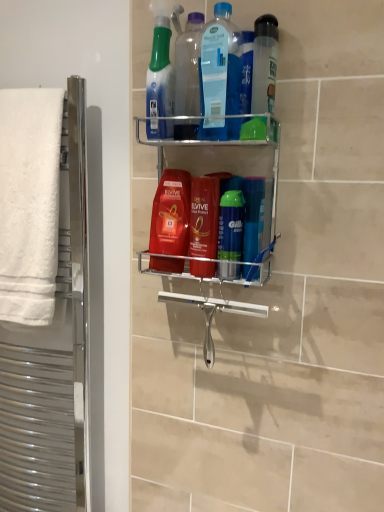
Image resolution: width=384 pixels, height=512 pixels. I want to click on transparent plastic bottle at upper center, so click(188, 66).

Find the location of a particular element. Image resolution: width=384 pixels, height=512 pixels. translucent plastic spray bottle at upper center, the first cleaning product from the top is located at coordinates (160, 76).

Which object is further away from the camera, transparent plastic bottle at upper center or blue plastic mouthwash at center, placed as the second mouthwash when sorted from right to left?

Positioned behind is blue plastic mouthwash at center, placed as the second mouthwash when sorted from right to left.

Where is `bottle on the left side of blue plastic mouthwash at center, which is counted as the third mouthwash, starting from the left`? bottle on the left side of blue plastic mouthwash at center, which is counted as the third mouthwash, starting from the left is located at coordinates (188, 66).

Is transparent plastic bottle at upper center oriented away from blue plastic mouthwash at center, placed as the second mouthwash when sorted from right to left?

No.

Does point (158, 76) appear closer or farther from the camera than point (257, 271)?

Point (158, 76).

Considering the sizes of translucent plastic spray bottle at upper center, the first cleaning product from the top, and blue plastic mouthwash at center, placed as the second mouthwash when sorted from right to left, in the image, is translucent plastic spray bottle at upper center, the first cleaning product from the top, taller or shorter than blue plastic mouthwash at center, placed as the second mouthwash when sorted from right to left,?

Clearly, translucent plastic spray bottle at upper center, the first cleaning product from the top, is taller compared to blue plastic mouthwash at center, placed as the second mouthwash when sorted from right to left.

There is a translucent plastic spray bottle at upper center, the first cleaning product from the top. Where is `the 3rd mouthwash below it (from a real-world perspective)`? The width and height of the screenshot is (384, 512). the 3rd mouthwash below it (from a real-world perspective) is located at coordinates (253, 218).

Is green matte mouthwash at center, arranged as the 3th mouthwash when viewed from the right, positioned behind transparent plastic bottle at upper center?

Yes, the depth of green matte mouthwash at center, arranged as the 3th mouthwash when viewed from the right, is greater than that of transparent plastic bottle at upper center.

Would you consider green matte mouthwash at center, placed as the 2th mouthwash when sorted from left to right, to be distant from transparent plastic bottle at upper center?

green matte mouthwash at center, placed as the 2th mouthwash when sorted from left to right, is near transparent plastic bottle at upper center, not far away.

Can you tell me how much green matte mouthwash at center, placed as the 2th mouthwash when sorted from left to right, and transparent plastic bottle at upper center differ in facing direction?

The facing directions of green matte mouthwash at center, placed as the 2th mouthwash when sorted from left to right, and transparent plastic bottle at upper center are 0.00641 degrees apart.

From the image's perspective, is green matte mouthwash at center, placed as the 2th mouthwash when sorted from left to right, located beneath transparent plastic bottle at upper center?

Correct, green matte mouthwash at center, placed as the 2th mouthwash when sorted from left to right, appears lower than transparent plastic bottle at upper center in the image.

Is red glossy mouthwash at center, the 4th mouthwash in the right-to-left sequence, to the right of white fluffy towel at left from the viewer's perspective?

Correct, you'll find red glossy mouthwash at center, the 4th mouthwash in the right-to-left sequence, to the right of white fluffy towel at left.

Is red glossy mouthwash at center, the 4th mouthwash in the right-to-left sequence, smaller than white fluffy towel at left?

Yes, red glossy mouthwash at center, the 4th mouthwash in the right-to-left sequence, is smaller than white fluffy towel at left.

Considering the relative sizes of red glossy mouthwash at center, the 4th mouthwash in the right-to-left sequence, and white fluffy towel at left in the image provided, is red glossy mouthwash at center, the 4th mouthwash in the right-to-left sequence, taller than white fluffy towel at left?

No.

Considering the sizes of shiny orange shampoo at center, placed as the 3th cleaning product when sorted from top to bottom, and metallic silver shelf at center in the image, is shiny orange shampoo at center, placed as the 3th cleaning product when sorted from top to bottom, bigger or smaller than metallic silver shelf at center?

shiny orange shampoo at center, placed as the 3th cleaning product when sorted from top to bottom, is smaller than metallic silver shelf at center.

Could you tell me if shiny orange shampoo at center, placed as the 3th cleaning product when sorted from top to bottom, is turned towards metallic silver shelf at center?

Yes.

Is point (168, 177) closer or farther from the camera than point (166, 160)?

Point (168, 177).

Is red glossy mouthwash at center, the 1th mouthwash viewed from the left, far from transparent plastic bottle at upper center?

No, there isn't a large distance between red glossy mouthwash at center, the 1th mouthwash viewed from the left, and transparent plastic bottle at upper center.

From a real-world perspective, does red glossy mouthwash at center, the 4th mouthwash in the right-to-left sequence, stand above transparent plastic bottle at upper center?

No, from a real-world perspective, red glossy mouthwash at center, the 4th mouthwash in the right-to-left sequence, is not on top of transparent plastic bottle at upper center.

Which object is thinner, red glossy mouthwash at center, the 1th mouthwash viewed from the left, or transparent plastic bottle at upper center?

With smaller width is transparent plastic bottle at upper center.

Who is smaller, white towel at left or red glossy mouthwash at center, the 4th mouthwash in the right-to-left sequence?

Smaller between the two is red glossy mouthwash at center, the 4th mouthwash in the right-to-left sequence.

Can you confirm if white towel at left is shorter than red glossy mouthwash at center, the 1th mouthwash viewed from the left?

No, white towel at left is not shorter than red glossy mouthwash at center, the 1th mouthwash viewed from the left.

Is white towel at left completely or partially outside of red glossy mouthwash at center, the 4th mouthwash in the right-to-left sequence?

Yes.

This screenshot has width=384, height=512. In order to click on bottle positioned vertically above the blue plastic mouthwash at center, placed as the second mouthwash when sorted from right to left (from a real-world perspective) in this screenshot , I will do `click(188, 66)`.

What are the coordinates of `the 3rd cleaning product above the blue plastic mouthwash at center, which is counted as the third mouthwash, starting from the left (from the image's perspective)` in the screenshot? It's located at (160, 76).

Based on their spatial positions, is metallic silver shelf at center or translucent plastic spray bottle at upper center, the 3th cleaning product in the bottom-to-top sequence, closer to clear plastic bottle at upper center, the fourth mouthwash from the left?

Based on the image, metallic silver shelf at center appears to be nearer to clear plastic bottle at upper center, the fourth mouthwash from the left.

Consider the image. Considering their positions, is translucent plastic spray bottle at upper center, the first cleaning product from the top, positioned further to white towel at left than green matte mouthwash at center, placed as the 2th mouthwash when sorted from left to right?

Based on the image, green matte mouthwash at center, placed as the 2th mouthwash when sorted from left to right, appears to be further to white towel at left.

Looking at the image, which one is located further to metallic silver shelf at center, green matte mouthwash at center, placed as the 2th mouthwash when sorted from left to right, or white fluffy towel at left?

The object further to metallic silver shelf at center is white fluffy towel at left.

From the image, which object appears to be farther from red glossy mouthwash at center, the 4th mouthwash in the right-to-left sequence, blue plastic mouthwash at center, which is counted as the third mouthwash, starting from the left, or blue translucent bottle at upper center, arranged as the second cleaning product when viewed from the top?

blue translucent bottle at upper center, arranged as the second cleaning product when viewed from the top, lies further to red glossy mouthwash at center, the 4th mouthwash in the right-to-left sequence, than the other object.

Estimate the real-world distances between objects in this image. Which object is further from green matte mouthwash at center, arranged as the 3th mouthwash when viewed from the right, red glossy mouthwash at center, the 4th mouthwash in the right-to-left sequence, or metallic silver shelf at center?

metallic silver shelf at center is positioned further to the anchor green matte mouthwash at center, arranged as the 3th mouthwash when viewed from the right.

Based on their spatial positions, is blue plastic mouthwash at center, placed as the second mouthwash when sorted from right to left, or translucent plastic spray bottle at upper center, the 3th cleaning product in the bottom-to-top sequence, further from green matte mouthwash at center, placed as the 2th mouthwash when sorted from left to right?

translucent plastic spray bottle at upper center, the 3th cleaning product in the bottom-to-top sequence, is further to green matte mouthwash at center, placed as the 2th mouthwash when sorted from left to right.

Estimate the real-world distances between objects in this image. Which object is further from red glossy mouthwash at center, the 1th mouthwash viewed from the left, blue plastic mouthwash at center, placed as the second mouthwash when sorted from right to left, or clear plastic bottle at upper center, the 1th mouthwash from the right?

clear plastic bottle at upper center, the 1th mouthwash from the right, is positioned further to the anchor red glossy mouthwash at center, the 1th mouthwash viewed from the left.

Based on their spatial positions, is transparent plastic bottle at upper center or translucent plastic spray bottle at upper center, the first cleaning product from the top, closer to shiny orange shampoo at center, placed as the 3th cleaning product when sorted from top to bottom?

transparent plastic bottle at upper center is positioned closer to the anchor shiny orange shampoo at center, placed as the 3th cleaning product when sorted from top to bottom.

Identify the location of bottle between translucent plastic spray bottle at upper center, the first cleaning product from the top, and green matte mouthwash at center, placed as the 2th mouthwash when sorted from left to right, in the vertical direction. The image size is (384, 512). (188, 66).

Where is `mouthwash between transparent plastic bottle at upper center and shiny orange shampoo at center, placed as the 1th cleaning product when sorted from bottom to top, in the vertical direction`? The width and height of the screenshot is (384, 512). mouthwash between transparent plastic bottle at upper center and shiny orange shampoo at center, placed as the 1th cleaning product when sorted from bottom to top, in the vertical direction is located at coordinates (264, 64).

At what (x,y) coordinates should I click in order to perform the action: click on bottle between white fluffy towel at left and metallic silver shelf at center in the horizontal direction. Please return your answer as a coordinate pair (x, y). The height and width of the screenshot is (512, 384). Looking at the image, I should click on (188, 66).

The image size is (384, 512). In order to click on shelf between transparent plastic bottle at upper center and white towel at left vertically in this screenshot , I will do `click(222, 162)`.